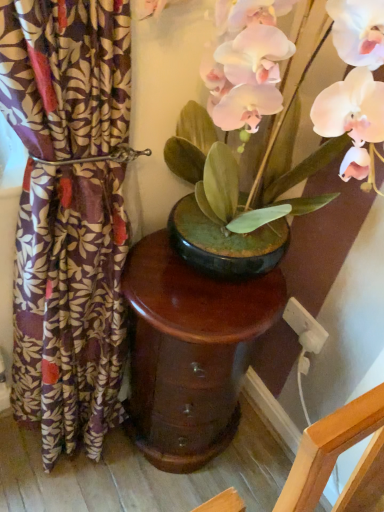
Question: Is white plastic electric outlet at lower right not inside patterned fabric curtain at left?

Choices:
 (A) no
 (B) yes

Answer: (B)

Question: Can you confirm if white plastic electric outlet at lower right is shorter than patterned fabric curtain at left?

Choices:
 (A) no
 (B) yes

Answer: (B)

Question: Could patterned fabric curtain at left be considered to be inside white plastic electric outlet at lower right?

Choices:
 (A) no
 (B) yes

Answer: (A)

Question: Is white plastic electric outlet at lower right thinner than patterned fabric curtain at left?

Choices:
 (A) no
 (B) yes

Answer: (B)

Question: From a real-world perspective, is white plastic electric outlet at lower right on patterned fabric curtain at left?

Choices:
 (A) no
 (B) yes

Answer: (A)

Question: Considering the relative sizes of white plastic electric outlet at lower right and patterned fabric curtain at left in the image provided, is white plastic electric outlet at lower right bigger than patterned fabric curtain at left?

Choices:
 (A) yes
 (B) no

Answer: (B)

Question: Is matte black pot at center bigger than glossy wood table at center?

Choices:
 (A) yes
 (B) no

Answer: (A)

Question: Does matte black pot at center have a lesser width compared to glossy wood table at center?

Choices:
 (A) no
 (B) yes

Answer: (A)

Question: Considering the relative sizes of matte black pot at center and glossy wood table at center in the image provided, is matte black pot at center taller than glossy wood table at center?

Choices:
 (A) no
 (B) yes

Answer: (A)

Question: From a real-world perspective, is matte black pot at center on glossy wood table at center?

Choices:
 (A) yes
 (B) no

Answer: (A)

Question: Can you confirm if matte black pot at center is shorter than glossy wood table at center?

Choices:
 (A) no
 (B) yes

Answer: (B)

Question: Is matte black pot at center outside glossy wood table at center?

Choices:
 (A) yes
 (B) no

Answer: (A)

Question: Does glossy wood table at center have a lesser width compared to patterned fabric curtain at left?

Choices:
 (A) yes
 (B) no

Answer: (B)